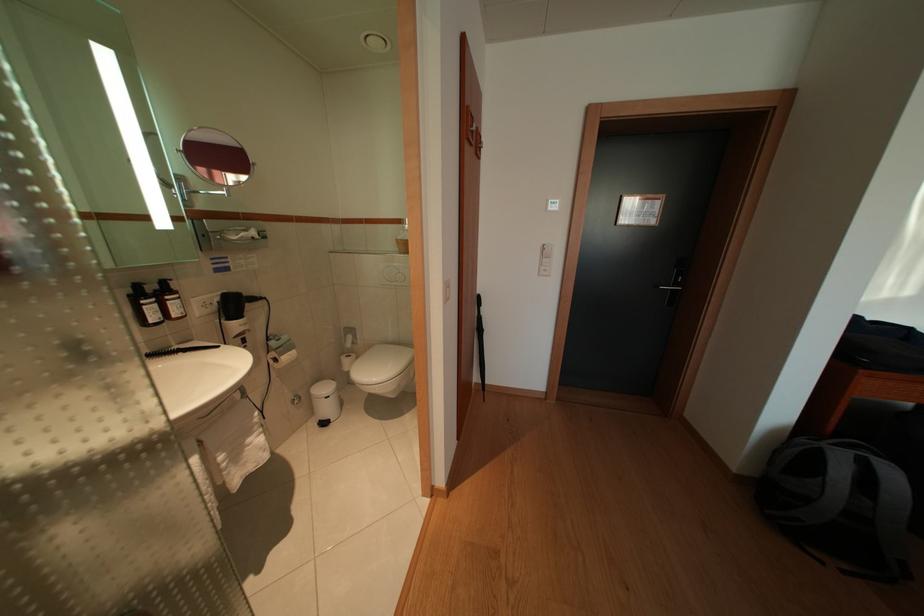
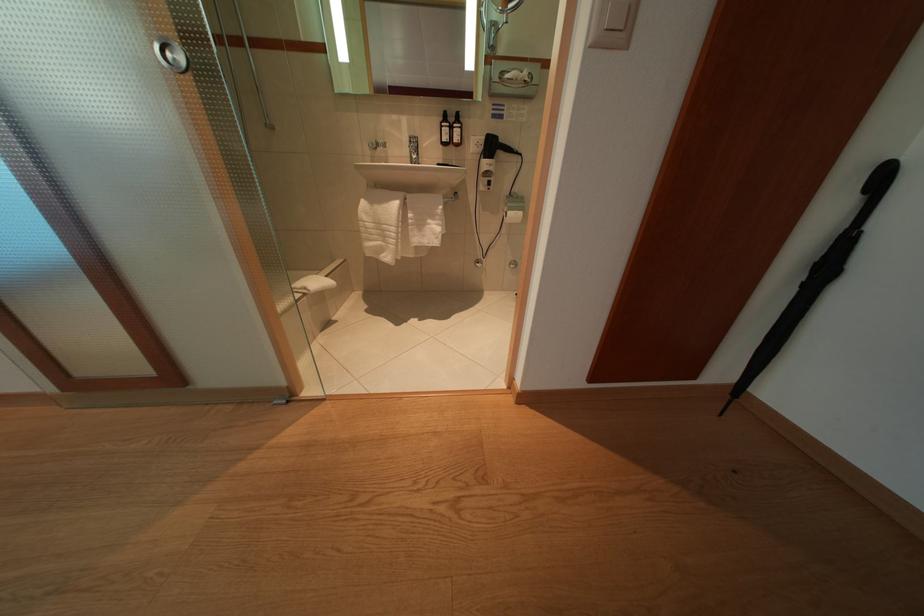
Find the pixel in the second image that matches point (489, 336) in the first image.

(834, 275)